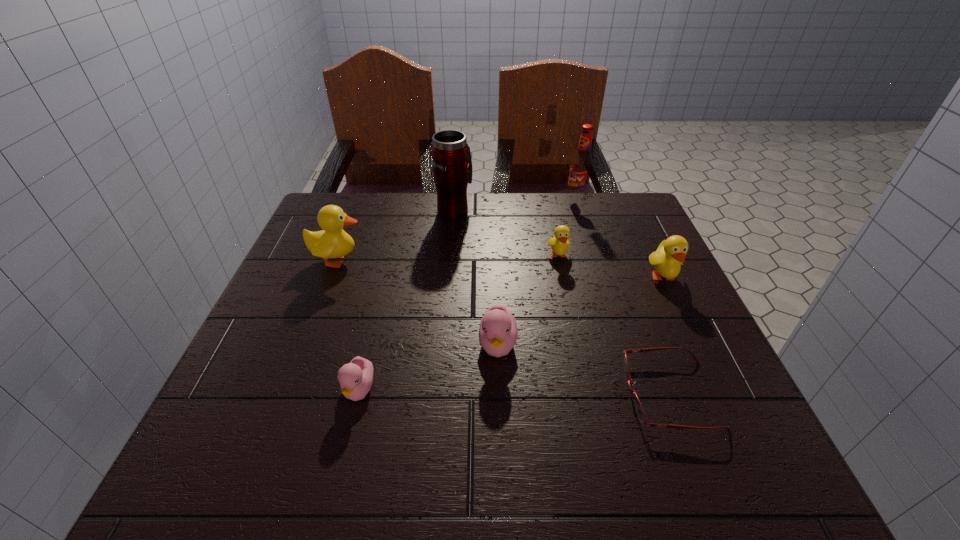
Locate an element on the screen. The height and width of the screenshot is (540, 960). spectacles positioned at the right edge is located at coordinates (639, 410).

Locate an element on the screen. This screenshot has height=540, width=960. object that is at the far right corner is located at coordinates (581, 168).

Find the location of a particular element. Image resolution: width=960 pixels, height=540 pixels. object at the near right corner is located at coordinates (639, 410).

I want to click on vacant region at the far edge of the desktop, so click(543, 237).

Locate an element on the screen. blank space at the near edge of the desktop is located at coordinates (482, 433).

In the image, there is a desktop. Where is `vacant space at the left edge`? This screenshot has height=540, width=960. vacant space at the left edge is located at coordinates (321, 306).

Image resolution: width=960 pixels, height=540 pixels. I want to click on vacant space at the right edge of the desktop, so click(x=620, y=251).

Identify the location of free space at the far left corner of the desktop. (324, 194).

Where is `vacant region at the far right corner`? The image size is (960, 540). vacant region at the far right corner is located at coordinates (608, 225).

Find the location of a particular element. This screenshot has width=960, height=540. vacant space that is in between the shortest object and the fifth object from right to left is located at coordinates (584, 370).